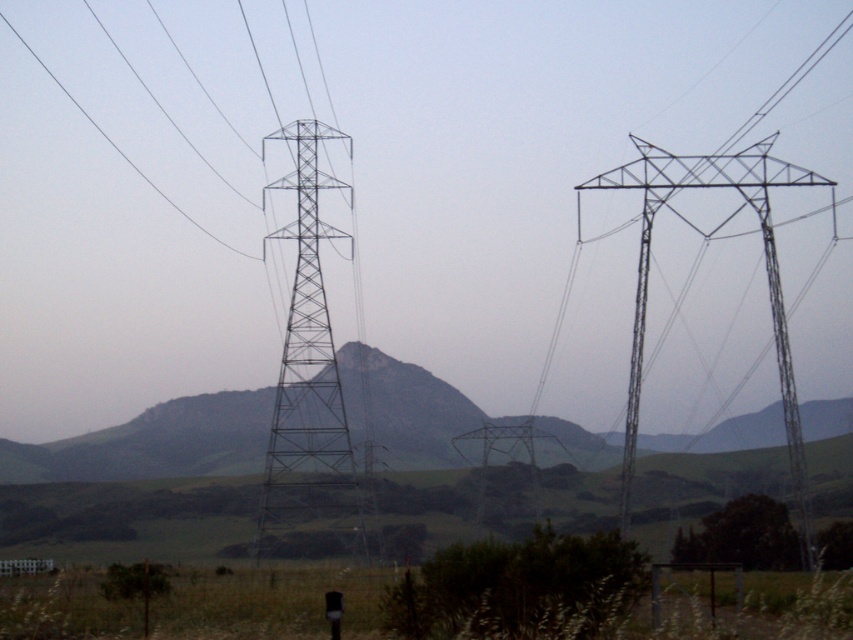
Who is more forward, (474, 420) or (717, 161)?

Positioned in front is point (717, 161).

Is rocky gray mountain at center wider than metallic silver tower at right?

Indeed, rocky gray mountain at center has a greater width compared to metallic silver tower at right.

Who is more forward, [840,401] or [688,225]?

Point [688,225]

I want to click on rocky gray mountain at center, so click(155, 442).

Is rocky gray mountain at center bigger than metallic gray tower at center?

Correct, rocky gray mountain at center is larger in size than metallic gray tower at center.

Is rocky gray mountain at center shorter than metallic gray tower at center?

Correct, rocky gray mountain at center is not as tall as metallic gray tower at center.

This screenshot has width=853, height=640. In order to click on rocky gray mountain at center in this screenshot , I will do `click(155, 442)`.

This screenshot has width=853, height=640. In order to click on rocky gray mountain at center in this screenshot , I will do `click(155, 442)`.

Based on the photo, does metallic gray tower at center have a smaller size compared to metallic silver tower at right?

Indeed, metallic gray tower at center has a smaller size compared to metallic silver tower at right.

This screenshot has width=853, height=640. I want to click on metallic gray tower at center, so click(x=308, y=388).

Image resolution: width=853 pixels, height=640 pixels. Describe the element at coordinates (308, 388) in the screenshot. I see `metallic gray tower at center` at that location.

I want to click on metallic gray tower at center, so click(308, 388).